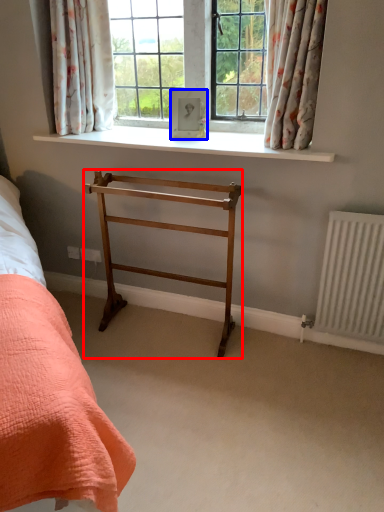
Question: Which of the following is the farthest to the observer, furniture (highlighted by a red box) or picture frame (highlighted by a blue box)?

Choices:
 (A) furniture
 (B) picture frame

Answer: (B)